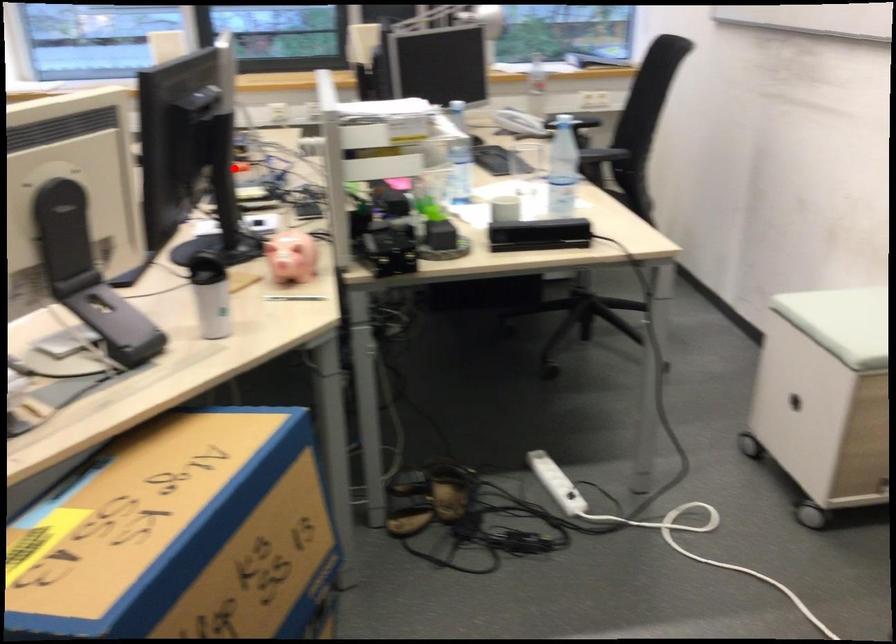
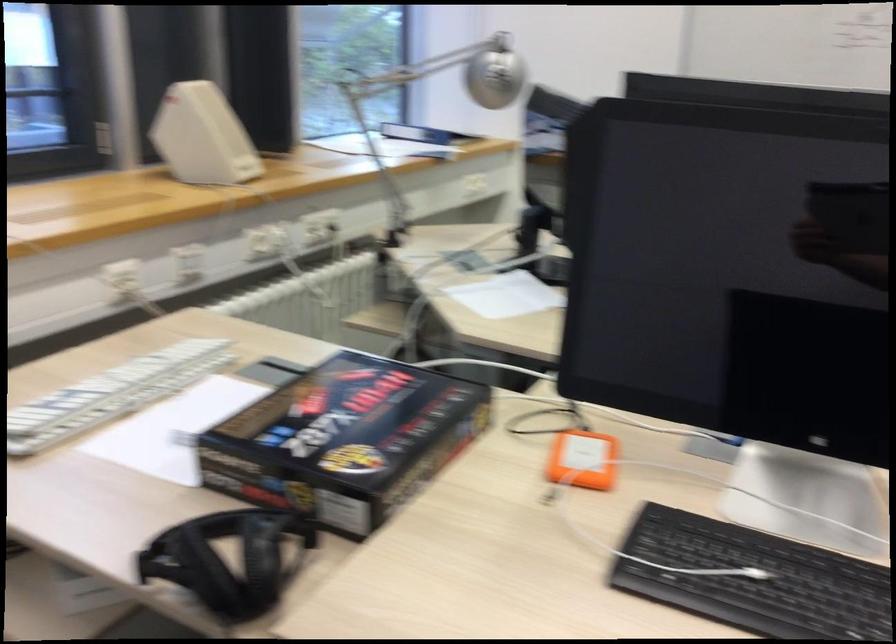
Locate, in the second image, the point that corresponds to the highlighted location in the first image.

(582, 460)